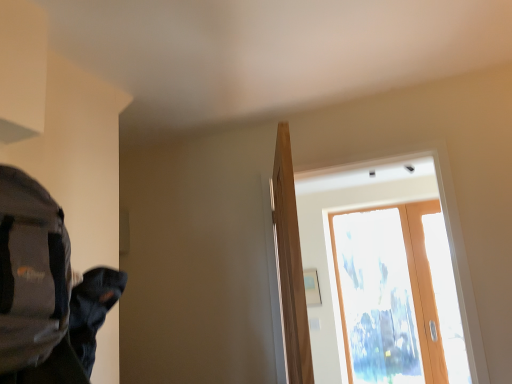
Question: Is the depth of transparent glass door at upper center less than that of gray fabric backpack at left?

Choices:
 (A) no
 (B) yes

Answer: (A)

Question: From the image's perspective, would you say transparent glass door at upper center is shown under gray fabric backpack at left?

Choices:
 (A) yes
 (B) no

Answer: (A)

Question: From the image's perspective, is transparent glass door at upper center located above gray fabric backpack at left?

Choices:
 (A) yes
 (B) no

Answer: (B)

Question: Can you confirm if transparent glass door at upper center is wider than gray fabric backpack at left?

Choices:
 (A) no
 (B) yes

Answer: (A)

Question: Is transparent glass door at upper center aimed at gray fabric backpack at left?

Choices:
 (A) yes
 (B) no

Answer: (A)

Question: From a real-world perspective, is transparent glass door at upper right positioned above or below light brown wood door at center?

Choices:
 (A) below
 (B) above

Answer: (B)

Question: Based on their positions, is transparent glass door at upper right located to the left or right of light brown wood door at center?

Choices:
 (A) right
 (B) left

Answer: (A)

Question: Is transparent glass door at upper right wider or thinner than light brown wood door at center?

Choices:
 (A) wide
 (B) thin

Answer: (B)

Question: Looking at the image, does transparent glass door at upper right seem bigger or smaller compared to light brown wood door at center?

Choices:
 (A) big
 (B) small

Answer: (B)

Question: Does point (49, 331) appear closer or farther from the camera than point (292, 364)?

Choices:
 (A) farther
 (B) closer

Answer: (B)

Question: Considering the positions of gray fabric backpack at left and light brown wood door at center in the image, is gray fabric backpack at left wider or thinner than light brown wood door at center?

Choices:
 (A) thin
 (B) wide

Answer: (B)

Question: Looking at the image, does gray fabric backpack at left seem bigger or smaller compared to light brown wood door at center?

Choices:
 (A) small
 (B) big

Answer: (A)

Question: From a real-world perspective, is gray fabric backpack at left positioned above or below light brown wood door at center?

Choices:
 (A) below
 (B) above

Answer: (B)

Question: Based on their positions, is transparent glass door at upper center located to the left or right of transparent glass door at upper right?

Choices:
 (A) right
 (B) left

Answer: (A)

Question: Is transparent glass door at upper center in front of or behind transparent glass door at upper right in the image?

Choices:
 (A) front
 (B) behind

Answer: (B)